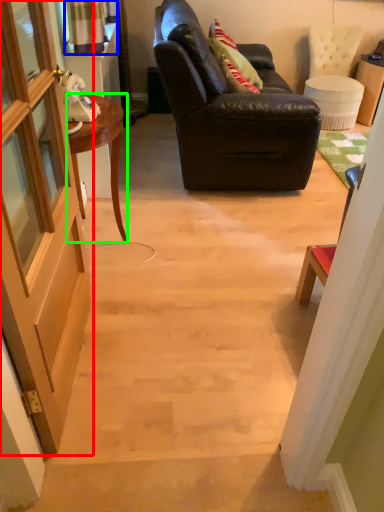
Question: Which object is positioned farthest from door (highlighted by a red box)? Select from curtain (highlighted by a blue box) and desk (highlighted by a green box).

Choices:
 (A) curtain
 (B) desk

Answer: (A)